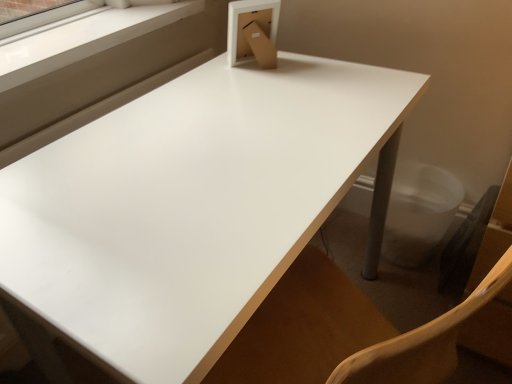
The height and width of the screenshot is (384, 512). What do you see at coordinates (188, 206) in the screenshot?
I see `white glossy table at center` at bounding box center [188, 206].

This screenshot has width=512, height=384. In order to click on white glossy table at center in this screenshot , I will do `click(188, 206)`.

Where is `white plastic window frame at upper left`? Image resolution: width=512 pixels, height=384 pixels. white plastic window frame at upper left is located at coordinates (85, 39).

Describe the element at coordinates (85, 39) in the screenshot. The image size is (512, 384). I see `white plastic window frame at upper left` at that location.

The image size is (512, 384). What are the coordinates of `white glossy table at center` in the screenshot? It's located at (188, 206).

Is white glossy table at center at the right side of white plastic window frame at upper left?

Yes, white glossy table at center is to the right of white plastic window frame at upper left.

Which object is closer to the camera, white glossy table at center or white plastic window frame at upper left?

Positioned in front is white glossy table at center.

Considering the points (77, 222) and (12, 72), which point is in front, point (77, 222) or point (12, 72)?

The point (77, 222) is closer.

From the image's perspective, which one is positioned higher, white glossy table at center or white plastic window frame at upper left?

white plastic window frame at upper left appears higher in the image.

From a real-world perspective, is white glossy table at center positioned over white plastic window frame at upper left based on gravity?

No, from a real-world perspective, white glossy table at center is not above white plastic window frame at upper left.

Considering the sizes of white glossy table at center and white plastic window frame at upper left in the image, is white glossy table at center wider or thinner than white plastic window frame at upper left?

white glossy table at center is wider than white plastic window frame at upper left.

Considering the relative sizes of white glossy table at center and white plastic window frame at upper left in the image provided, is white glossy table at center shorter than white plastic window frame at upper left?

No, white glossy table at center is not shorter than white plastic window frame at upper left.

Between white glossy table at center and white plastic window frame at upper left, which one has larger size?

white glossy table at center.

Is white glossy table at center situated inside white plastic window frame at upper left or outside?

white glossy table at center is outside white plastic window frame at upper left.

Is white glossy table at center next to white plastic window frame at upper left?

No, white glossy table at center is not in contact with white plastic window frame at upper left.

Could you tell me if white glossy table at center is turned towards white plastic window frame at upper left?

No, white glossy table at center is not oriented towards white plastic window frame at upper left.

Looking at this image, what's the angular difference between white glossy table at center and white plastic window frame at upper left's facing directions?

0.355 degrees separate the facing orientations of white glossy table at center and white plastic window frame at upper left.

How distant is white glossy table at center from white plastic window frame at upper left?

They are 48.95 centimeters apart.

Where is `window frame that is behind the white glossy table at center`? window frame that is behind the white glossy table at center is located at coordinates (85, 39).

Can you confirm if white plastic window frame at upper left is positioned to the right of white glossy table at center?

No.

Which is behind, white plastic window frame at upper left or white glossy table at center?

white plastic window frame at upper left is behind.

Considering the positions of points (29, 66) and (82, 340), is point (29, 66) farther from camera compared to point (82, 340)?

Yes, it is behind point (82, 340).

From the image's perspective, which object appears higher, white plastic window frame at upper left or white glossy table at center?

white plastic window frame at upper left, from the image's perspective.

From a real-world perspective, between white plastic window frame at upper left and white glossy table at center, who is vertically higher?

white plastic window frame at upper left is physically above.

Does white plastic window frame at upper left have a greater width compared to white glossy table at center?

No.

Which of these two, white plastic window frame at upper left or white glossy table at center, stands shorter?

white plastic window frame at upper left.

Between white plastic window frame at upper left and white glossy table at center, which one has smaller size?

white plastic window frame at upper left.

Is white plastic window frame at upper left not within white glossy table at center?

Yes, white plastic window frame at upper left is not within white glossy table at center.

Are white plastic window frame at upper left and white glossy table at center far apart?

They are positioned close to each other.

Is white plastic window frame at upper left looking in the opposite direction of white glossy table at center?

No, white plastic window frame at upper left is not facing away from white glossy table at center.

Where is `window frame located behind the white glossy table at center`? window frame located behind the white glossy table at center is located at coordinates (85, 39).

Locate an element on the screen. The height and width of the screenshot is (384, 512). table in front of the white plastic window frame at upper left is located at coordinates (188, 206).

Find the location of a particular element. table on the right of the white plastic window frame at upper left is located at coordinates (188, 206).